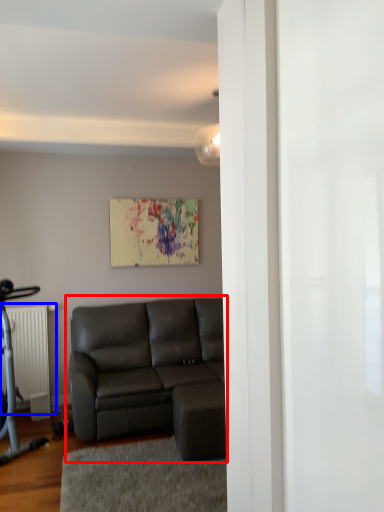
Question: Which point is closer to the camera, studio couch (highlighted by a red box) or radiator (highlighted by a blue box)?

Choices:
 (A) studio couch
 (B) radiator

Answer: (A)